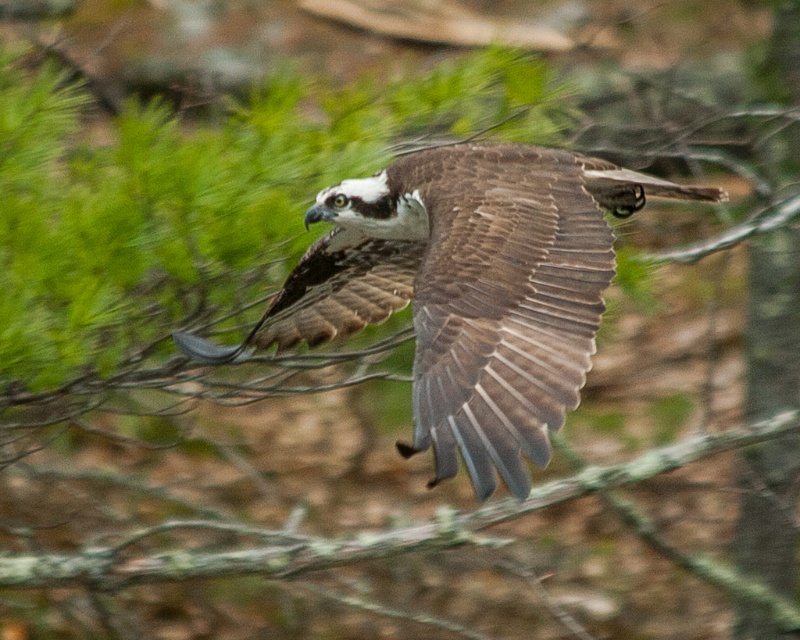
Can you confirm if brown feathered wing at center is shorter than green mossy branch at center?

Indeed, brown feathered wing at center has a lesser height compared to green mossy branch at center.

Is point (528, 477) in front of point (649, 461)?

Yes, point (528, 477) is in front of point (649, 461).

Is point (498, 468) more distant than point (69, 576)?

That is False.

Locate an element on the screen. brown feathered wing at center is located at coordinates click(x=500, y=301).

Can you confirm if brown feathered eagle at center is positioned below green mossy branch at center?

No, brown feathered eagle at center is not below green mossy branch at center.

Locate an element on the screen. brown feathered eagle at center is located at coordinates (468, 289).

Consider the image. How much distance is there between brown feathered eagle at center and brown feathered wing at center?

brown feathered eagle at center and brown feathered wing at center are 2.58 inches apart from each other.

Does brown feathered eagle at center have a lesser width compared to brown feathered wing at center?

No.

Is point (502, 396) closer to viewer compared to point (448, 262)?

Yes, point (502, 396) is in front of point (448, 262).

In order to click on brown feathered eagle at center in this screenshot , I will do `click(468, 289)`.